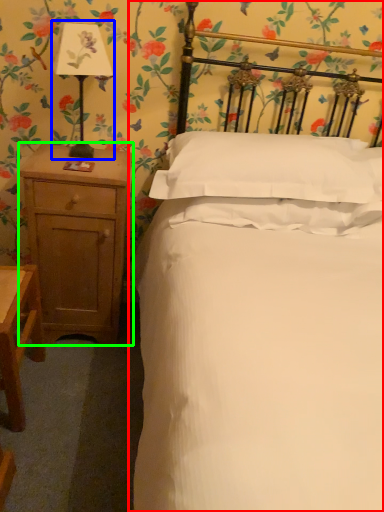
Question: Estimate the real-world distances between objects in this image. Which object is farther from bed (highlighted by a red box), bedside lamp (highlighted by a blue box) or nightstand (highlighted by a green box)?

Choices:
 (A) bedside lamp
 (B) nightstand

Answer: (A)